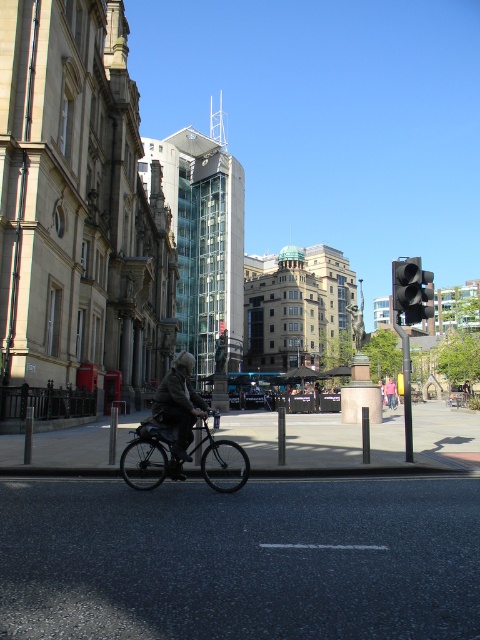
From the picture: Which is below, black matte traffic light at upper right or denim jacket at center?

Positioned lower is denim jacket at center.

Does black matte traffic light at upper right lie in front of denim jacket at center?

Yes.

The height and width of the screenshot is (640, 480). I want to click on black matte traffic light at upper right, so click(x=410, y=289).

Find the location of a particular element. black matte traffic light at upper right is located at coordinates (410, 289).

Between shiny metallic bicycle at center and denim jacket at center, which one has less height?

shiny metallic bicycle at center is shorter.

Find the location of a particular element. This screenshot has width=480, height=640. shiny metallic bicycle at center is located at coordinates (149, 456).

Between dark gray fabric jacket at center and denim jacket at center, which one is positioned higher?

dark gray fabric jacket at center is higher up.

You are a GUI agent. You are given a task and a screenshot of the screen. Output one action in this format:
    pyautogui.click(x=<x>, y=<y>)
    Task: Click on the dark gray fabric jacket at center
    The height and width of the screenshot is (640, 480).
    Given the screenshot: What is the action you would take?
    pyautogui.click(x=179, y=406)